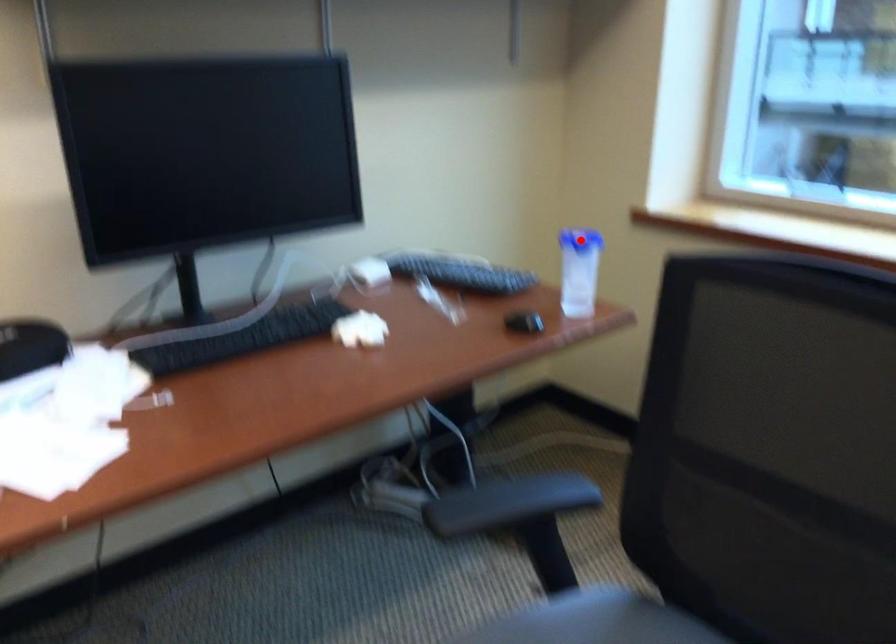
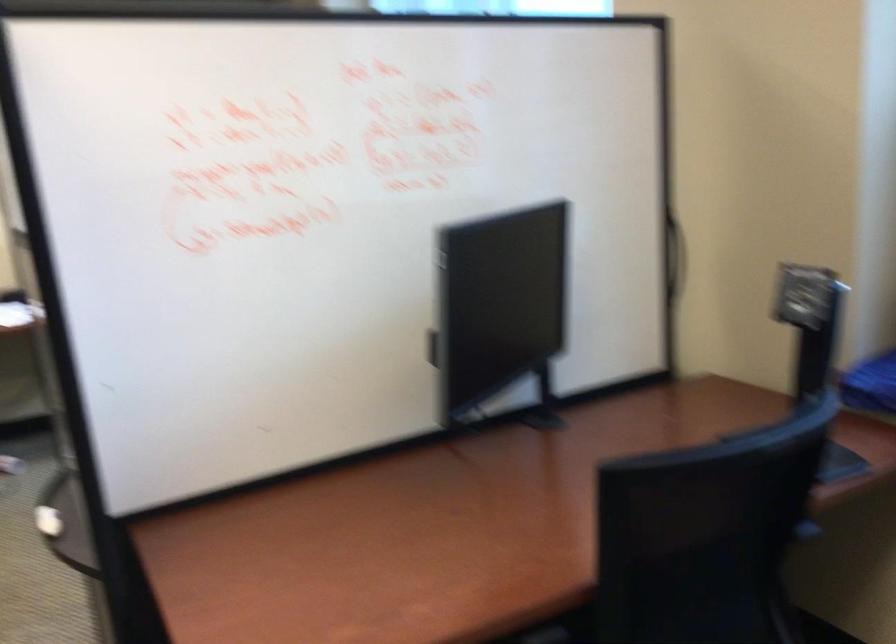
Question: I am providing you with two images of the same scene from different viewpoints. A red point is marked on the first image. Can you still see the location of the red point in image 2?

Choices:
 (A) Yes
 (B) No

Answer: (B)